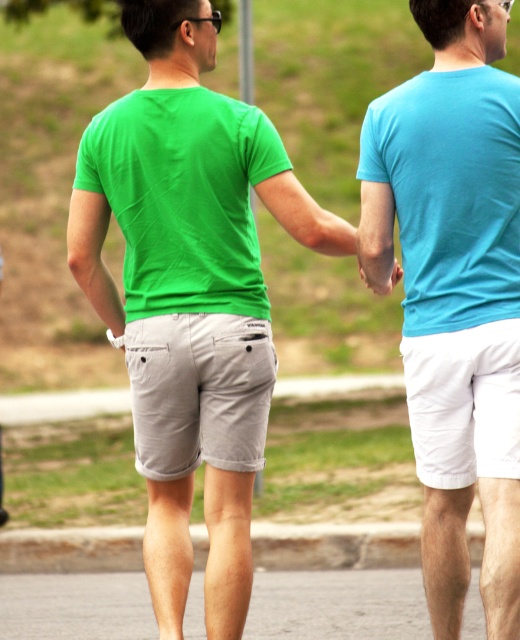
Question: Can you confirm if matte blue t-shirt at center is wider than gray cotton shorts at center?

Choices:
 (A) yes
 (B) no

Answer: (A)

Question: Can you confirm if matte green t-shirt at center is positioned below matte blue t-shirt at center?

Choices:
 (A) yes
 (B) no

Answer: (B)

Question: Which point is closer to the camera taking this photo?

Choices:
 (A) (505, 317)
 (B) (151, 435)
 (C) (360, 230)

Answer: (A)

Question: Which object is the farthest from the gray cotton shorts at center?

Choices:
 (A) matte blue t-shirt at center
 (B) matte skin hand at center

Answer: (A)

Question: Where is matte blue t-shirt at center located in relation to gray cotton shorts at center in the image?

Choices:
 (A) right
 (B) left

Answer: (A)

Question: Which object appears farthest from the camera in this image?

Choices:
 (A) matte skin hand at center
 (B) gray cotton shorts at center
 (C) matte green t-shirt at center

Answer: (A)